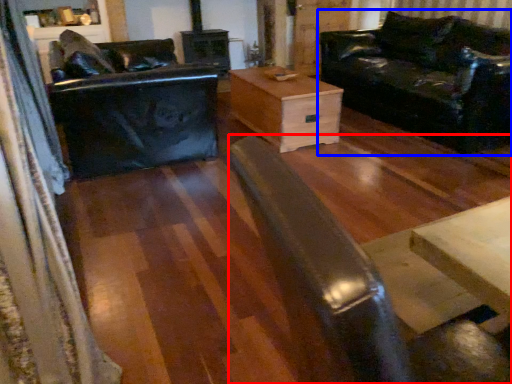
Question: Which object appears closest to the camera in this image, wide (highlighted by a red box) or studio couch (highlighted by a blue box)?

Choices:
 (A) wide
 (B) studio couch

Answer: (A)